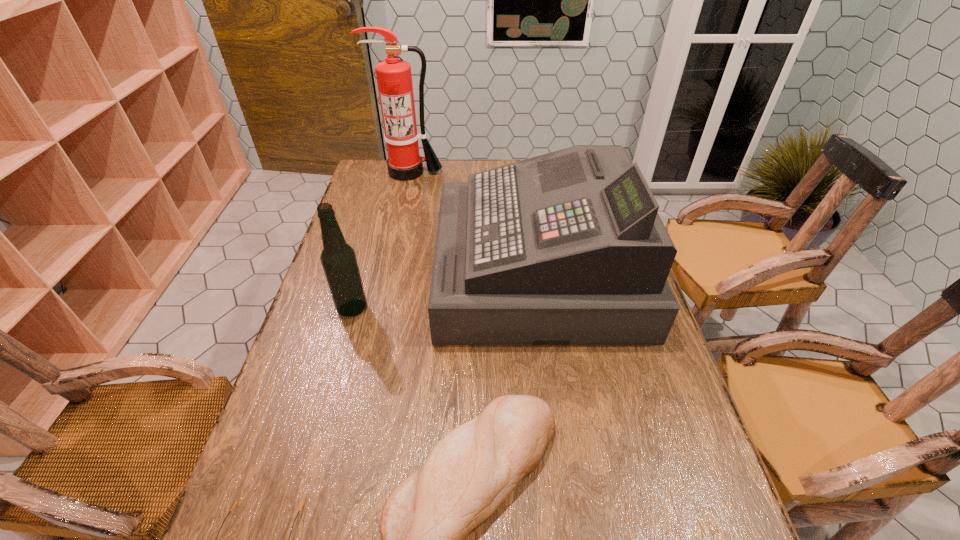
Locate an element on the screen. The width and height of the screenshot is (960, 540). the farthest object is located at coordinates (394, 78).

The width and height of the screenshot is (960, 540). Identify the location of the tallest object. (394, 78).

Identify the location of cash register. (567, 248).

Where is `alcohol`? This screenshot has height=540, width=960. alcohol is located at coordinates pyautogui.click(x=338, y=258).

The height and width of the screenshot is (540, 960). I want to click on vacant space located at the nozzle of the farthest object, so click(394, 237).

This screenshot has height=540, width=960. Find the location of `vacant space positioned 0.250m on the front-facing side of the cash register`. vacant space positioned 0.250m on the front-facing side of the cash register is located at coordinates (355, 271).

Locate an element on the screen. vacant region located on the front-facing side of the cash register is located at coordinates (399, 271).

Locate an element on the screen. The image size is (960, 540). free region located on the front-facing side of the cash register is located at coordinates click(x=352, y=271).

Where is `blank area located 0.180m on the right of the alcohol`? The width and height of the screenshot is (960, 540). blank area located 0.180m on the right of the alcohol is located at coordinates (433, 308).

You are a GUI agent. You are given a task and a screenshot of the screen. Output one action in this format:
    pyautogui.click(x=<x>, y=<y>)
    Task: Click on the object that is at the far edge
    The height and width of the screenshot is (540, 960).
    Given the screenshot: What is the action you would take?
    pyautogui.click(x=394, y=78)